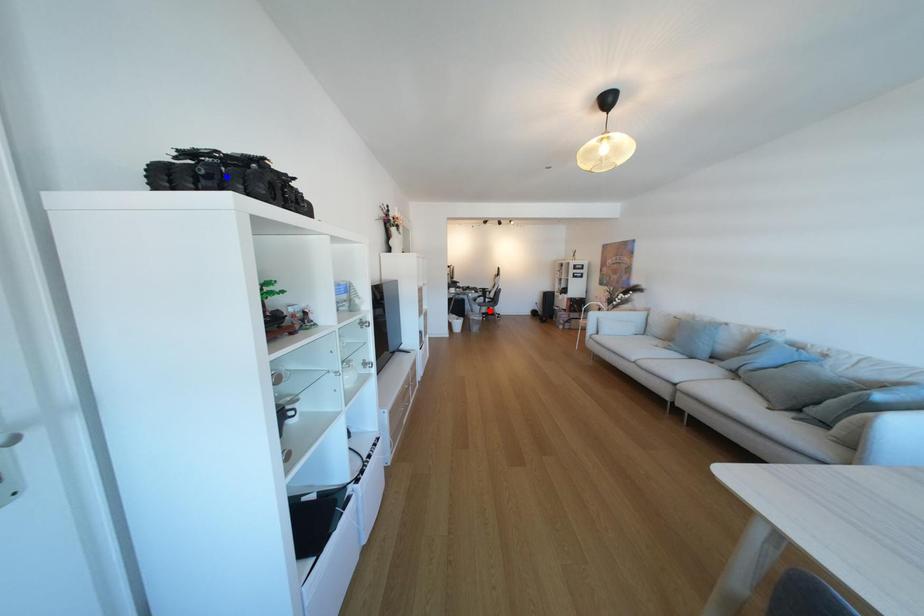
Question: Which of the two points in the image is closer to the camera?

Choices:
 (A) Blue point is closer.
 (B) Red point is closer.

Answer: (A)